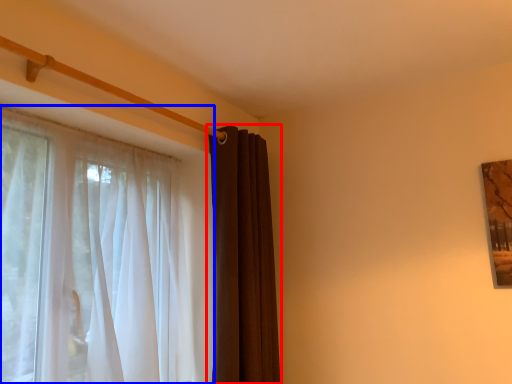
Question: Among these objects, which one is farthest to the camera, curtain (highlighted by a red box) or curtain (highlighted by a blue box)?

Choices:
 (A) curtain
 (B) curtain

Answer: (A)